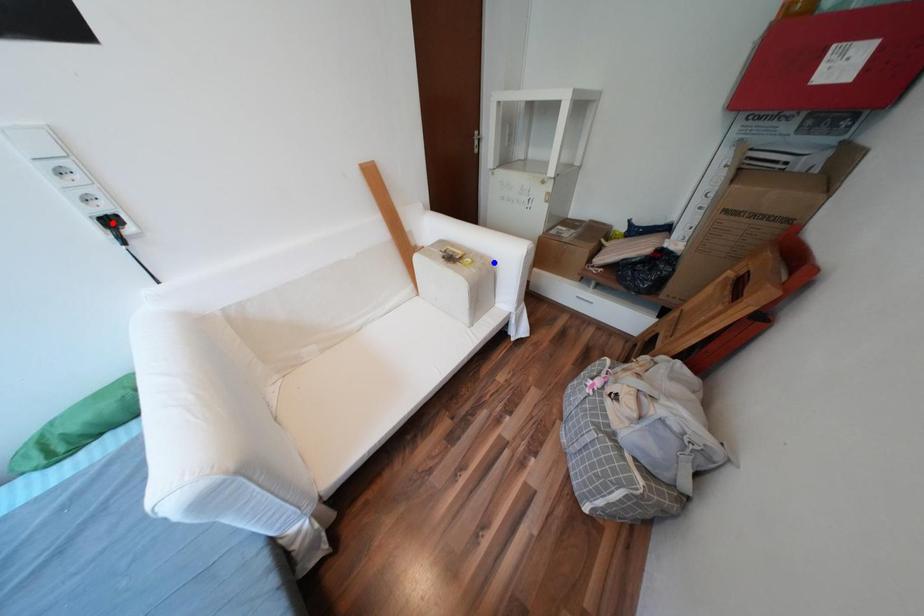
Question: Two points are marked on the image. Which point is closer to the camera?

Choices:
 (A) Blue point is closer.
 (B) Red point is closer.

Answer: (B)